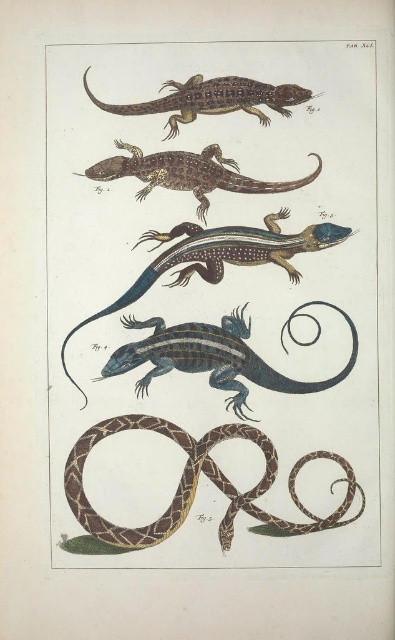
Question: Which point appears farthest from the camera in this image?

Choices:
 (A) (137, 358)
 (B) (212, 240)

Answer: (B)

Question: In this image, where is brown textured snake at center located relative to shiny blue and black lizard at center?

Choices:
 (A) above
 (B) below

Answer: (B)

Question: Is blue glossy lizard at center thinner than shiny brown lizard at center?

Choices:
 (A) yes
 (B) no

Answer: (B)

Question: Which point is farther to the camera?

Choices:
 (A) (165, 422)
 (B) (141, 326)
 (C) (148, 180)
 (D) (238, 77)

Answer: (D)

Question: Does blue glossy lizard at center appear on the left side of shiny blue and black lizard at center?

Choices:
 (A) yes
 (B) no

Answer: (B)

Question: Which object is the closest to the shiny brown lizard at center?

Choices:
 (A) brown textured snake at center
 (B) shiny blue and black lizard at center

Answer: (B)